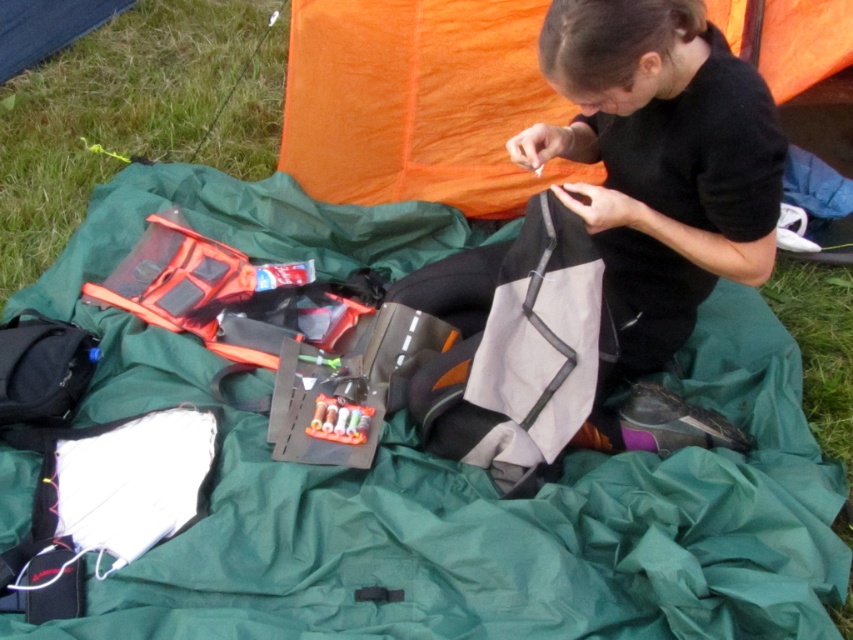
Describe the element at coordinates (515, 531) in the screenshot. The image size is (853, 640). I see `green fabric blanket at center` at that location.

Between green fabric blanket at center and black matte fabric bag at center, which one has more height?

With more height is green fabric blanket at center.

Find the location of a particular element. This screenshot has width=853, height=640. green fabric blanket at center is located at coordinates (515, 531).